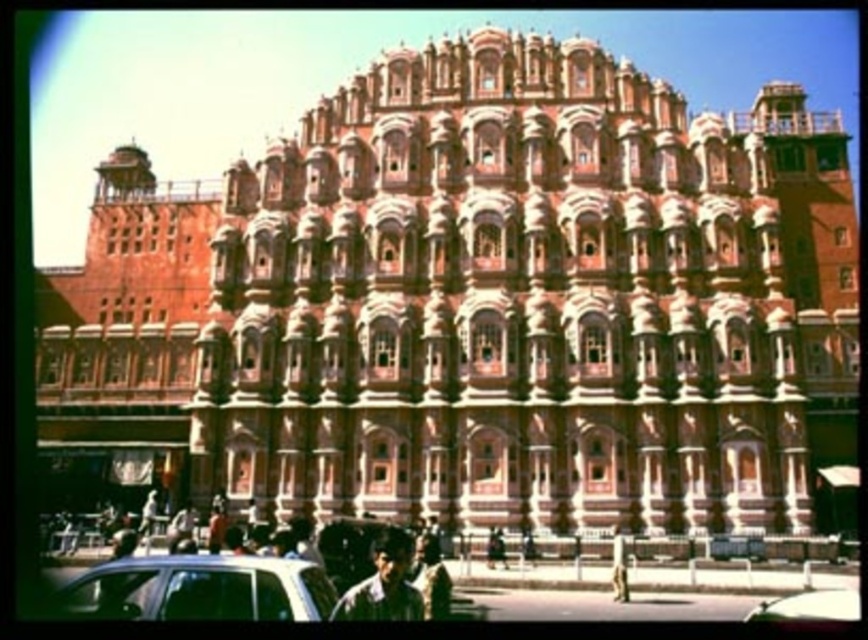
Question: Does white glossy car at lower left appear over metallic silver car at lower center?

Choices:
 (A) no
 (B) yes

Answer: (B)

Question: Which object appears closest to the camera in this image?

Choices:
 (A) white glossy car at lower left
 (B) metallic silver car at lower center

Answer: (A)

Question: Is white glossy car at lower left below metallic silver car at lower center?

Choices:
 (A) yes
 (B) no

Answer: (B)

Question: Can you confirm if white glossy car at lower left is bigger than metallic silver car at lower center?

Choices:
 (A) yes
 (B) no

Answer: (A)

Question: Which object is farther from the camera taking this photo?

Choices:
 (A) metallic silver car at lower center
 (B) white glossy car at lower left

Answer: (A)